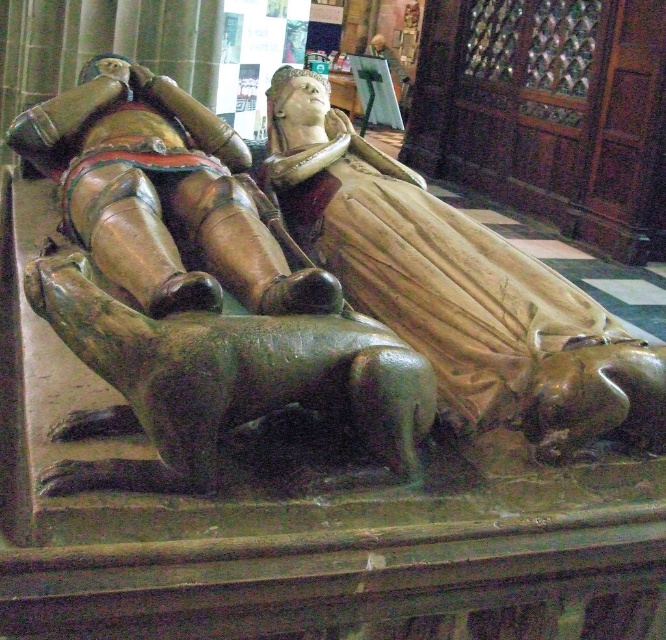
Question: Is matte gold statue at center smaller than polished bronze knight at center?

Choices:
 (A) yes
 (B) no

Answer: (A)

Question: Does matte gold statue at center appear over polished bronze knight at center?

Choices:
 (A) no
 (B) yes

Answer: (B)

Question: Observing the image, what is the correct spatial positioning of matte gold statue at center in reference to polished bronze knight at center?

Choices:
 (A) below
 (B) above

Answer: (B)

Question: Among these objects, which one is farthest from the camera?

Choices:
 (A) matte gold statue at center
 (B) polished bronze knight at center

Answer: (A)

Question: Which point is closer to the camera?

Choices:
 (A) (216, 196)
 (B) (517, 256)

Answer: (A)